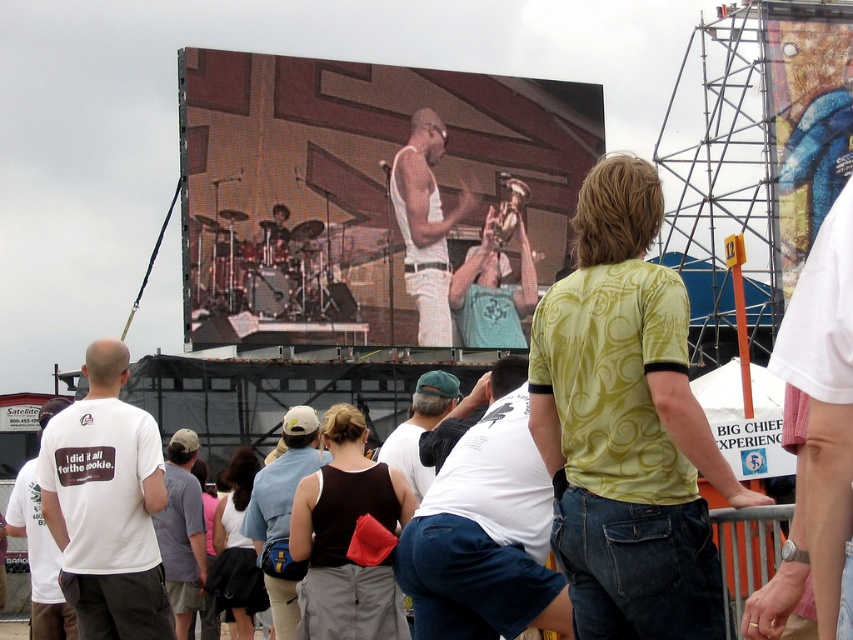
You are a photographer at the concert and want to capture the performer clearly. Since the white tank top at center and denim shorts at center are both visible, which one should you focus on to ensure the performer is in focus?

The white tank top at center is larger in size than denim shorts at center, so focusing on the white tank top at center would ensure the performer is in focus as it is the more prominent part of his outfit.

You are a photographer at the concert. You want to take a photo of the performer wearing the white tank top at center without the white cotton shirt at center blocking the view. Is this possible?

The white cotton shirt at center is in front of the white tank top at center, so it will block the view. You cannot take a photo of the performer wearing the white tank top at center without the white cotton shirt at center blocking the view.

You are standing in the concert crowd and want to move forward to get a better view of the stage. There are two points marked in the image, point A at coordinates point (96, 636) and point B at coordinates point (44, 593). Which point should you move towards to be closer to the stage?

Point A at coordinates point (96, 636) is closer to the viewer than point B at coordinates point (44, 593), so moving towards point A will bring you closer to the stage.